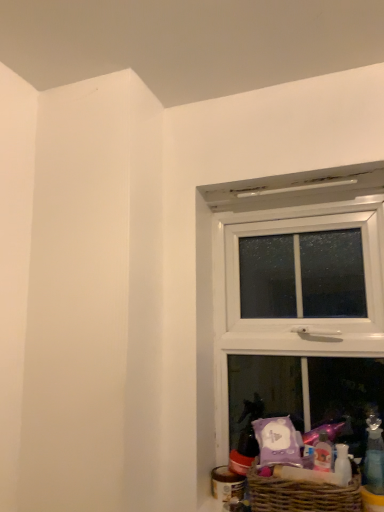
Question: Considering the relative sizes of white plastic window at upper right and transparent plastic bottle at lower right in the image provided, is white plastic window at upper right smaller than transparent plastic bottle at lower right?

Choices:
 (A) no
 (B) yes

Answer: (A)

Question: Is white plastic window at upper right further to the viewer compared to transparent plastic bottle at lower right?

Choices:
 (A) yes
 (B) no

Answer: (A)

Question: Is white plastic window at upper right located outside transparent plastic bottle at lower right?

Choices:
 (A) yes
 (B) no

Answer: (A)

Question: Can you confirm if white plastic window at upper right is shorter than transparent plastic bottle at lower right?

Choices:
 (A) no
 (B) yes

Answer: (A)

Question: Is white plastic window at upper right surrounding transparent plastic bottle at lower right?

Choices:
 (A) no
 (B) yes

Answer: (A)

Question: From a real-world perspective, is white plastic window at upper right located beneath transparent plastic bottle at lower right?

Choices:
 (A) yes
 (B) no

Answer: (B)

Question: Is brown wicker basket at lower right wider than transparent plastic bottle at lower right?

Choices:
 (A) no
 (B) yes

Answer: (B)

Question: Would you consider brown wicker basket at lower right to be distant from transparent plastic bottle at lower right?

Choices:
 (A) no
 (B) yes

Answer: (A)

Question: From the image's perspective, is brown wicker basket at lower right located beneath transparent plastic bottle at lower right?

Choices:
 (A) no
 (B) yes

Answer: (B)

Question: From a real-world perspective, is brown wicker basket at lower right physically below transparent plastic bottle at lower right?

Choices:
 (A) yes
 (B) no

Answer: (A)

Question: Considering the relative positions of brown wicker basket at lower right and transparent plastic bottle at lower right in the image provided, is brown wicker basket at lower right to the right of transparent plastic bottle at lower right from the viewer's perspective?

Choices:
 (A) yes
 (B) no

Answer: (B)

Question: Does brown wicker basket at lower right have a smaller size compared to transparent plastic bottle at lower right?

Choices:
 (A) yes
 (B) no

Answer: (B)

Question: Is transparent plastic bottle at lower right at the left side of brown wicker basket at lower right?

Choices:
 (A) no
 (B) yes

Answer: (A)